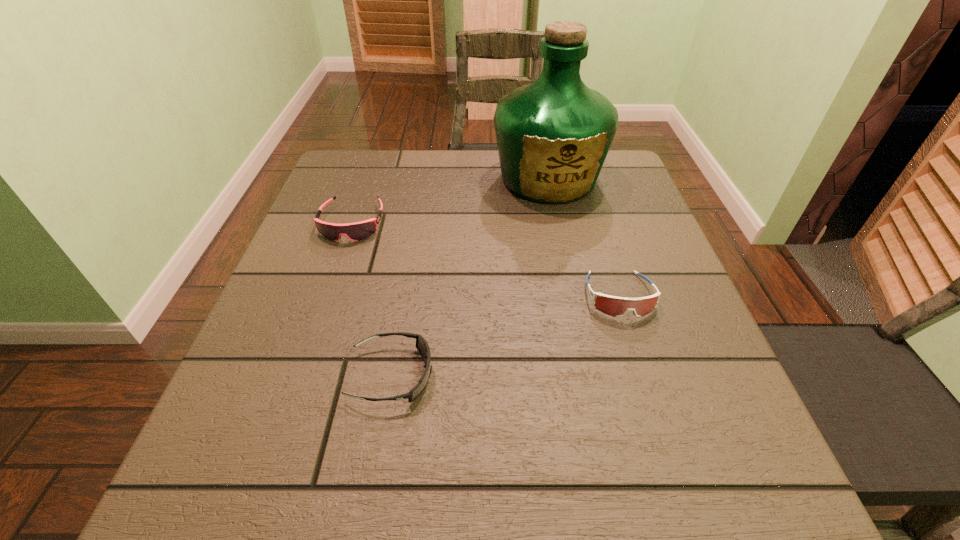
Identify the location of vacant area located on the lenses of the third object from right to left. (639, 375).

Find the location of `object that is at the far edge`. object that is at the far edge is located at coordinates (553, 135).

Locate an element on the screen. The height and width of the screenshot is (540, 960). object present at the left edge is located at coordinates click(x=357, y=231).

You are a GUI agent. You are given a task and a screenshot of the screen. Output one action in this format:
    pyautogui.click(x=<x>, y=<y>)
    Task: Click on the liquor that is at the right edge
    The image size is (960, 540).
    Given the screenshot: What is the action you would take?
    pyautogui.click(x=553, y=135)

Locate an element on the screen. The image size is (960, 540). goggles at the right edge is located at coordinates (614, 306).

Image resolution: width=960 pixels, height=540 pixels. Find the location of `object present at the far right corner`. object present at the far right corner is located at coordinates click(x=553, y=135).

Locate an element on the screen. vacant space at the far edge of the desktop is located at coordinates (462, 162).

Where is `vacant space at the near edge of the desktop`? This screenshot has width=960, height=540. vacant space at the near edge of the desktop is located at coordinates (392, 525).

Find the location of a particular element. The image size is (960, 540). free space at the left edge is located at coordinates (304, 330).

At what (x,y) coordinates should I click in order to perform the action: click on vacant space at the right edge. Please return your answer as a coordinate pair (x, y). Image resolution: width=960 pixels, height=540 pixels. Looking at the image, I should click on (612, 219).